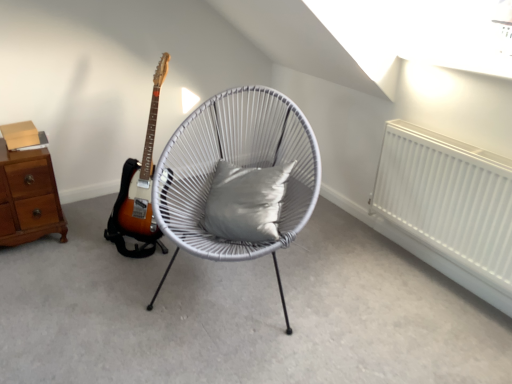
Question: Would you say white woven chair at center is part of white matte radiator at right's contents?

Choices:
 (A) no
 (B) yes

Answer: (A)

Question: Is white matte radiator at right positioned before white woven chair at center?

Choices:
 (A) no
 (B) yes

Answer: (A)

Question: Is white matte radiator at right smaller than white woven chair at center?

Choices:
 (A) yes
 (B) no

Answer: (A)

Question: Considering the relative positions of white matte radiator at right and white woven chair at center in the image provided, is white matte radiator at right behind white woven chair at center?

Choices:
 (A) no
 (B) yes

Answer: (B)

Question: Considering the relative sizes of white matte radiator at right and white woven chair at center in the image provided, is white matte radiator at right bigger than white woven chair at center?

Choices:
 (A) no
 (B) yes

Answer: (A)

Question: Does white matte radiator at right have a greater height compared to white woven chair at center?

Choices:
 (A) yes
 (B) no

Answer: (B)

Question: Is brown wood chest of drawers at left at the right side of gray fabric pillow at center?

Choices:
 (A) yes
 (B) no

Answer: (B)

Question: Does brown wood chest of drawers at left have a lesser height compared to gray fabric pillow at center?

Choices:
 (A) no
 (B) yes

Answer: (A)

Question: Is brown wood chest of drawers at left taller than gray fabric pillow at center?

Choices:
 (A) no
 (B) yes

Answer: (B)

Question: Is brown wood chest of drawers at left wider than gray fabric pillow at center?

Choices:
 (A) no
 (B) yes

Answer: (B)

Question: Is brown wood chest of drawers at left further to camera compared to gray fabric pillow at center?

Choices:
 (A) yes
 (B) no

Answer: (A)

Question: Considering the relative sizes of brown wood chest of drawers at left and gray fabric pillow at center in the image provided, is brown wood chest of drawers at left smaller than gray fabric pillow at center?

Choices:
 (A) no
 (B) yes

Answer: (A)

Question: Considering the relative positions of white matte radiator at right and gray fabric pillow at center in the image provided, is white matte radiator at right to the left of gray fabric pillow at center from the viewer's perspective?

Choices:
 (A) no
 (B) yes

Answer: (A)